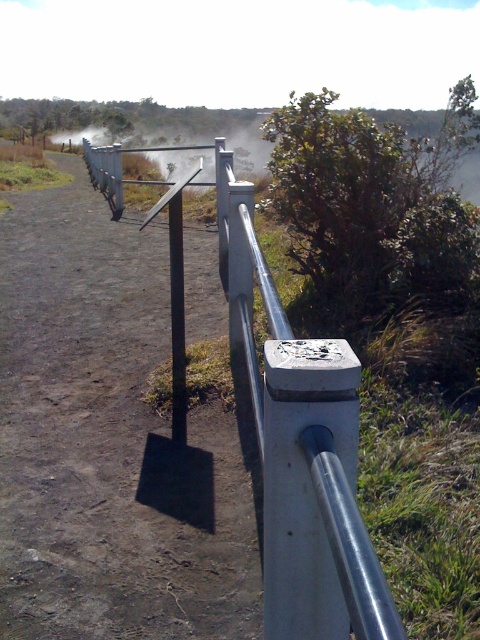
Question: Is metallic gray path at center behind silver metallic fence at center?

Choices:
 (A) no
 (B) yes

Answer: (B)

Question: Which point is closer to the camera?

Choices:
 (A) (140, 380)
 (B) (326, 380)

Answer: (B)

Question: From the image, what is the correct spatial relationship of metallic gray path at center in relation to silver metallic fence at center?

Choices:
 (A) above
 (B) below

Answer: (B)

Question: Which point appears farthest from the camera in this image?

Choices:
 (A) (273, 458)
 (B) (133, 456)

Answer: (B)

Question: Does metallic gray path at center lie behind silver metallic fence at center?

Choices:
 (A) yes
 (B) no

Answer: (A)